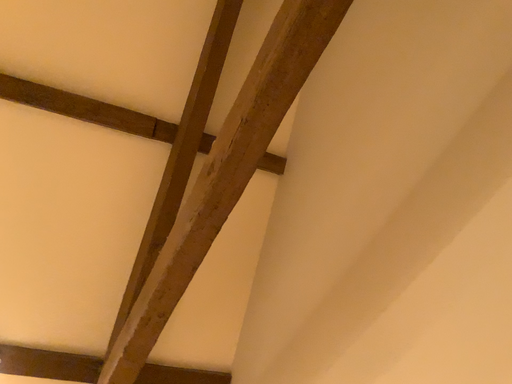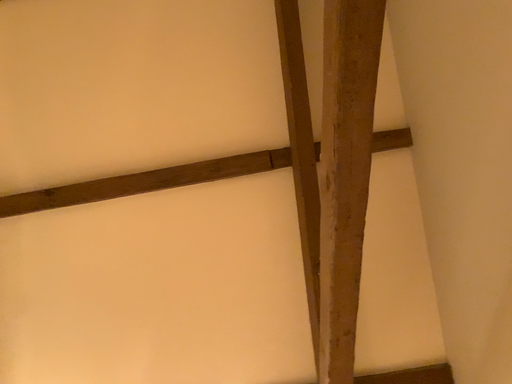
Question: Which way did the camera rotate in the video?

Choices:
 (A) rotated left
 (B) rotated right

Answer: (A)